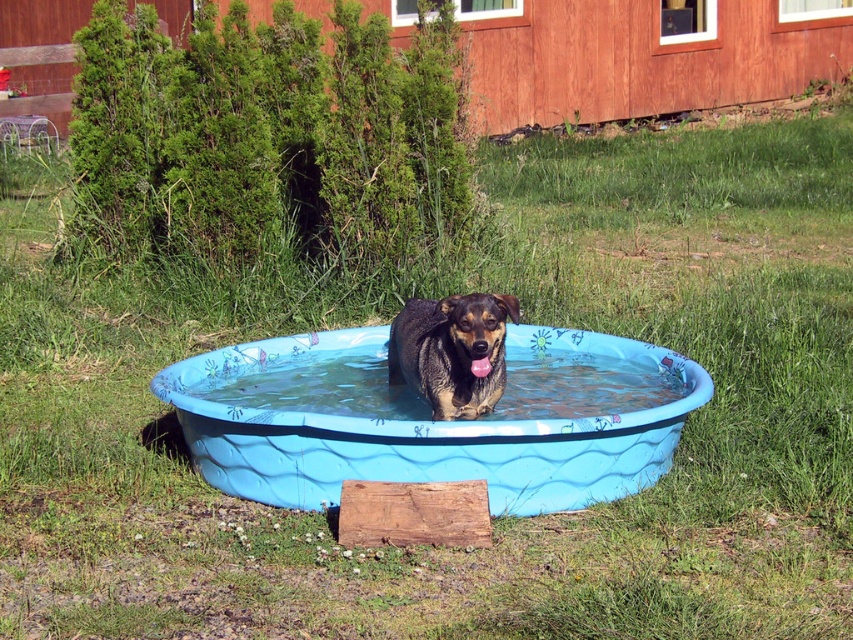
Does point (699, 378) come closer to viewer compared to point (263, 380)?

That is True.

Measure the distance between blue plastic tub at center and camera.

The distance of blue plastic tub at center from camera is 15.20 feet.

This screenshot has width=853, height=640. I want to click on blue plastic tub at center, so click(x=426, y=433).

Locate an element on the screen. blue plastic tub at center is located at coordinates (426, 433).

Based on the photo, who is lower down, blue plastic tub at center or brown fur dog at center?

blue plastic tub at center is below.

Is blue plastic tub at center bigger than brown fur dog at center?

Yes.

Who is more forward, (490, 490) or (457, 298)?

Point (490, 490) is in front.

I want to click on blue plastic tub at center, so click(x=426, y=433).

Can you confirm if blue plastic water at center is bigger than brown fur dog at center?

No, blue plastic water at center is not bigger than brown fur dog at center.

Can you confirm if blue plastic water at center is wider than brown fur dog at center?

Yes.

Who is more distant from viewer, (381, 355) or (469, 332)?

Point (381, 355)

You are a GUI agent. You are given a task and a screenshot of the screen. Output one action in this format:
    pyautogui.click(x=<x>, y=<y>)
    Task: Click on the blue plastic water at center
    This screenshot has width=853, height=640.
    Given the screenshot: What is the action you would take?
    pyautogui.click(x=320, y=387)